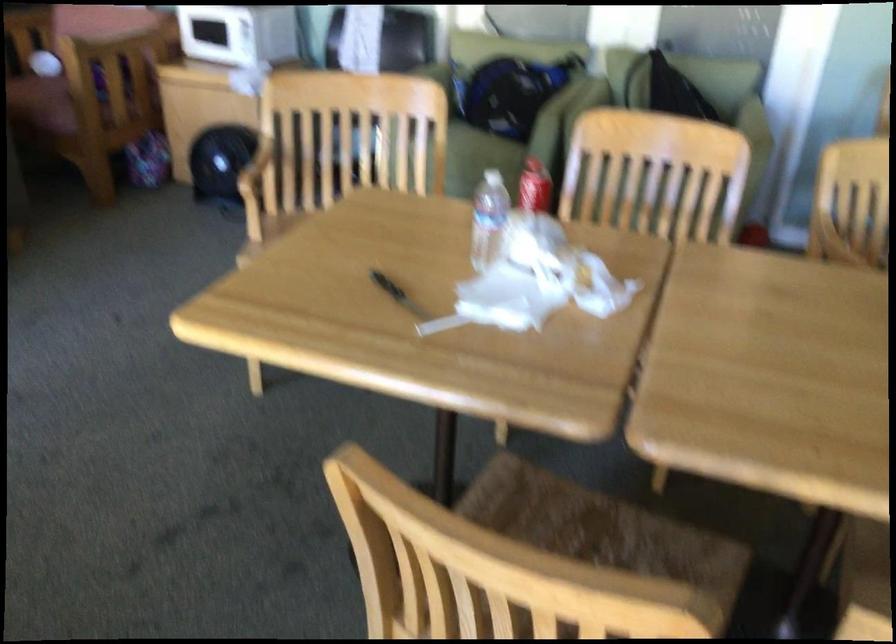
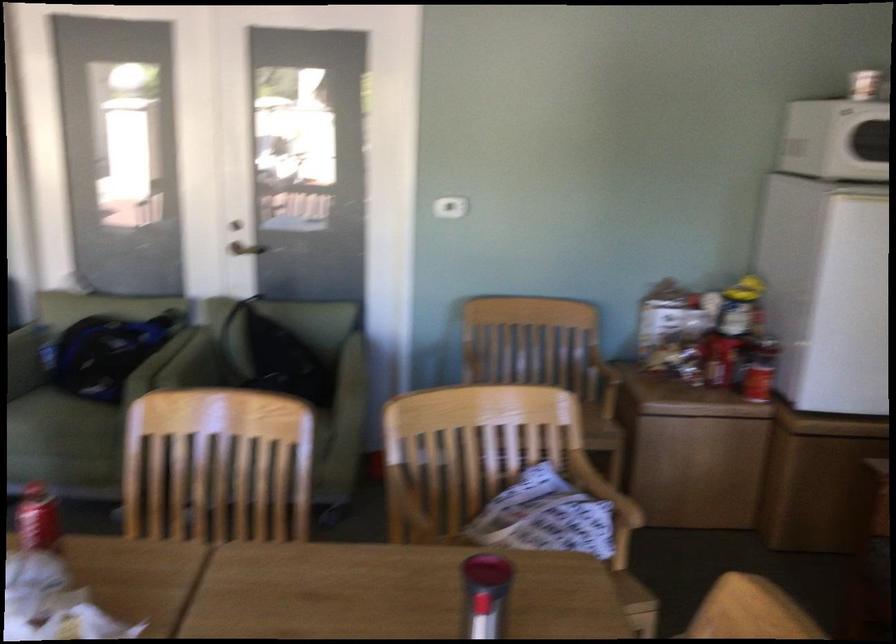
Where in the second image is the point corresponding to [467,146] from the first image?

(61, 424)